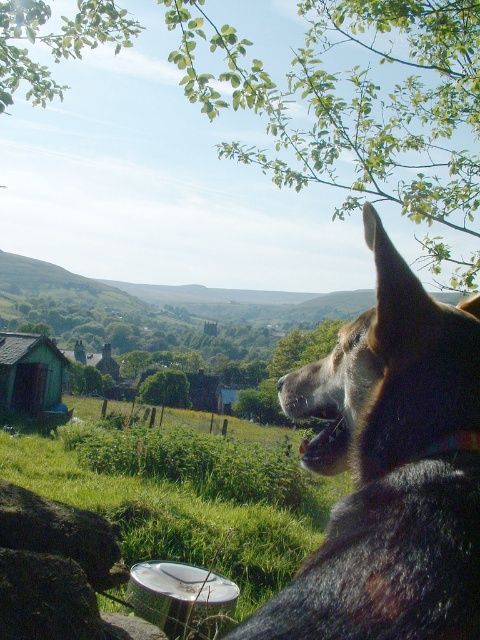
I want to click on green leafy tree at upper center, so click(x=358, y=109).

Does green leafy tree at upper center appear on the left side of brushed metal bucket at lower center?

No, green leafy tree at upper center is not to the left of brushed metal bucket at lower center.

From the picture: Measure the distance between green leafy tree at upper center and camera.

A distance of 12.97 feet exists between green leafy tree at upper center and camera.

Where is `green leafy tree at upper center`? This screenshot has height=640, width=480. green leafy tree at upper center is located at coordinates (358, 109).

Who is more distant from viewer, (411,518) or (159,376)?

Point (159,376)

Is black fur dog at right in front of green leafy tree at center?

Yes, it is.

Is point (427, 296) farther from viewer compared to point (180, 376)?

No.

This screenshot has width=480, height=640. I want to click on black fur dog at right, so click(x=391, y=470).

Can you confirm if green leafy tree at upper center is positioned below smooth gray rock at lower left?

Incorrect, green leafy tree at upper center is not positioned below smooth gray rock at lower left.

Between green leafy tree at upper center and smooth gray rock at lower left, which one has less height?

smooth gray rock at lower left

Between point (230, 106) and point (54, 513), which one is positioned behind?

Point (230, 106)

I want to click on green leafy tree at upper center, so click(358, 109).